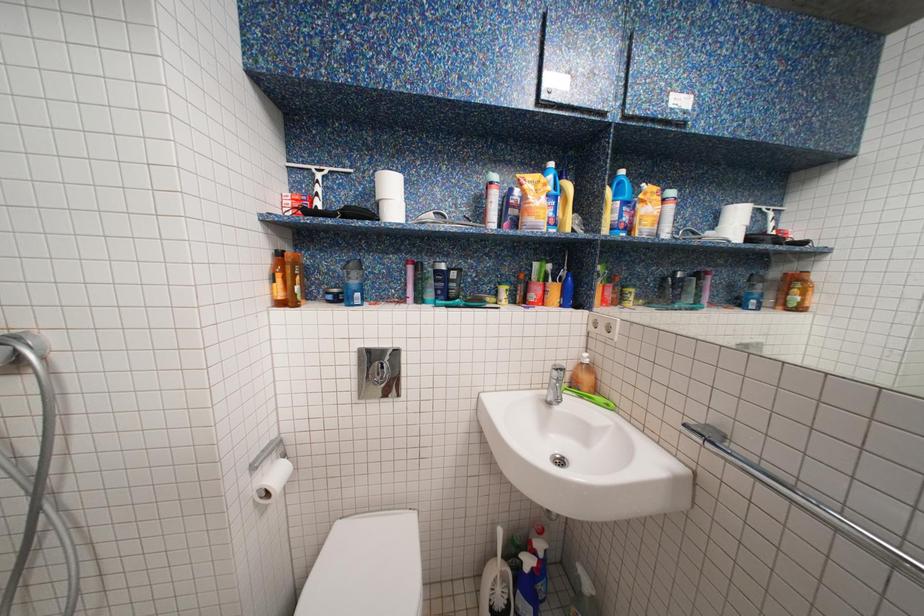
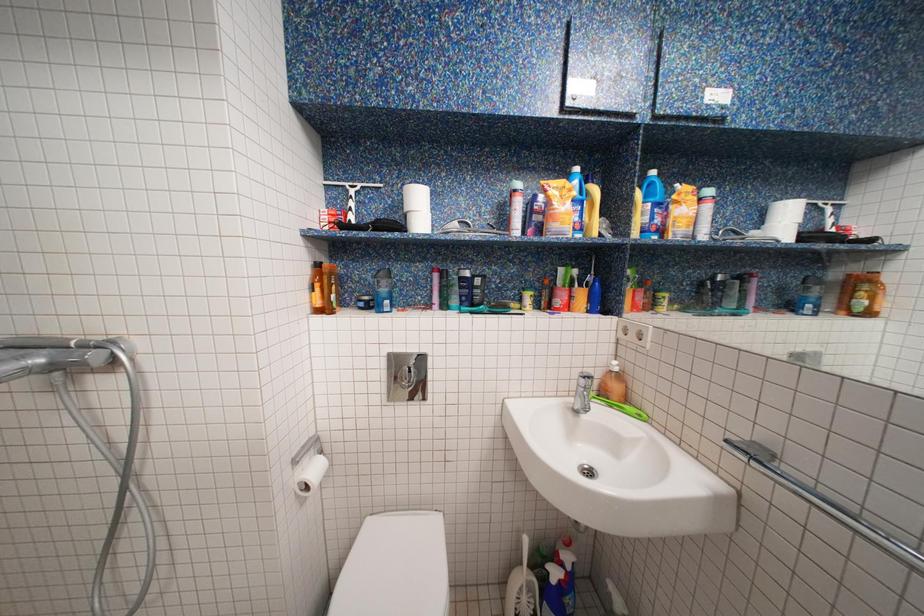
What movement of the cameraman would produce the second image?

The cameraman walked toward left, backward.